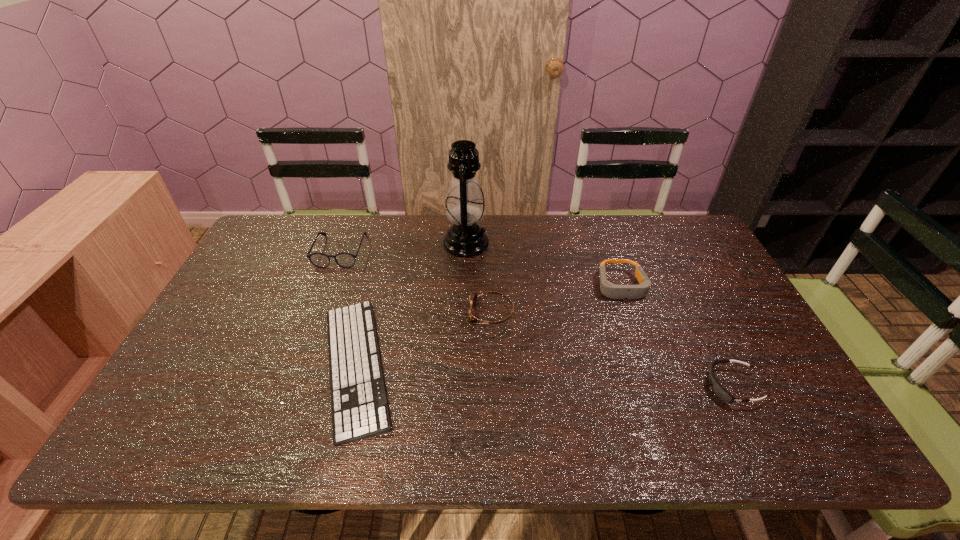
This screenshot has height=540, width=960. In order to click on goggles that is the second nearest to the tallest object in this screenshot , I will do `click(608, 289)`.

Identify which goggles is the second nearest to the fifth object from left to right. Please provide its 2D coordinates. Your answer should be formatted as a tuple, i.e. [(x, y)], where the tuple contains the x and y coordinates of a point satisfying the conditions above.

[(472, 316)]

Where is `free space that satisfies the following two spatial constraints: 1. on the front and back of the third tallest object; 2. through the lenses of the leftmost goggles`? free space that satisfies the following two spatial constraints: 1. on the front and back of the third tallest object; 2. through the lenses of the leftmost goggles is located at coordinates (630, 313).